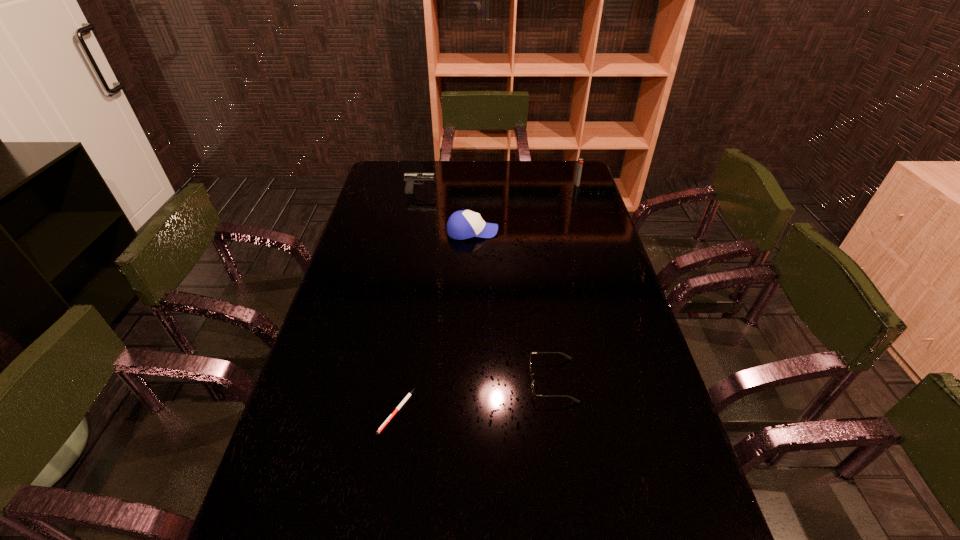
The width and height of the screenshot is (960, 540). I want to click on free space between the tallest object and the pen, so click(487, 298).

Locate an element on the screen. The height and width of the screenshot is (540, 960). free spot between the fourth object from left to right and the third object from right to left is located at coordinates (513, 306).

This screenshot has height=540, width=960. Find the location of `free space between the igniter and the shortest object`. free space between the igniter and the shortest object is located at coordinates (487, 298).

At what (x,y) coordinates should I click in order to perform the action: click on vacant area that lies between the pen and the pistol. Please return your answer as a coordinate pair (x, y). Image resolution: width=960 pixels, height=540 pixels. Looking at the image, I should click on (408, 302).

The width and height of the screenshot is (960, 540). I want to click on object identified as the third closest to the baseball cap, so click(x=532, y=381).

Select which object is the fourth closest to the third nearest object. Please provide its 2D coordinates. Your answer should be formatted as a tuple, i.e. [(x, y)], where the tuple contains the x and y coordinates of a point satisfying the conditions above.

[(406, 398)]

Where is `vacant space that satisfies the following two spatial constraints: 1. on the front-facing side of the third object from left to right; 2. on the clicker of the pen`? vacant space that satisfies the following two spatial constraints: 1. on the front-facing side of the third object from left to right; 2. on the clicker of the pen is located at coordinates (468, 411).

The width and height of the screenshot is (960, 540). I want to click on vacant area in the image that satisfies the following two spatial constraints: 1. on the front-facing side of the spectacles; 2. on the clicker of the pen, so click(x=557, y=411).

What are the coordinates of `blank area in the image that satisfies the following two spatial constraints: 1. on the front-facing side of the baseball cap; 2. on the clicker of the shortest object` in the screenshot? It's located at (468, 411).